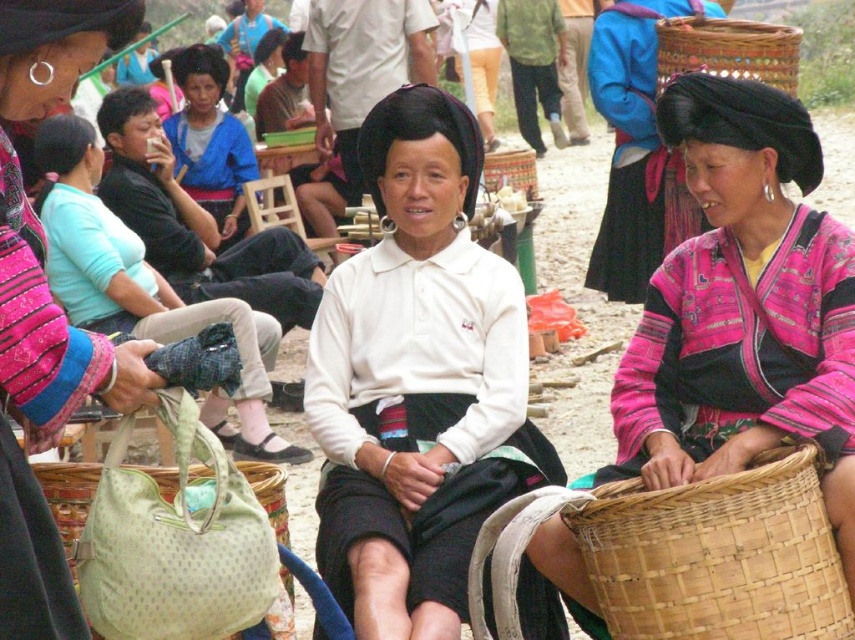
Is blue fabric shirt at center shorter than woven bamboo basket at upper right?

No, blue fabric shirt at center is not shorter than woven bamboo basket at upper right.

Based on the photo, is blue fabric shirt at center above woven bamboo basket at upper right?

Yes, blue fabric shirt at center is above woven bamboo basket at upper right.

You are a GUI agent. You are given a task and a screenshot of the screen. Output one action in this format:
    pyautogui.click(x=<x>, y=<y>)
    Task: Click on the blue fabric shirt at center
    
    Given the screenshot: What is the action you would take?
    pyautogui.click(x=210, y=140)

Does point (438, 470) come closer to viewer compared to point (664, 40)?

Yes.

Can you confirm if white matte shirt at center is positioned to the left of woven bamboo basket at upper right?

Yes, white matte shirt at center is to the left of woven bamboo basket at upper right.

Does point (425, 120) come in front of point (747, 77)?

Yes, point (425, 120) is closer to viewer.

This screenshot has width=855, height=640. In order to click on white matte shirt at center in this screenshot , I will do `click(417, 381)`.

Between point (753, 122) and point (199, 124), which one is positioned behind?

The point (199, 124) is behind.

Is point (743, 396) positioned after point (217, 138)?

No, it is in front of (217, 138).

Who is more forward, (768, 90) or (225, 129)?

Point (768, 90) is more forward.

Locate an element on the screen. Image resolution: width=855 pixels, height=640 pixels. pink woven fabric at center is located at coordinates (741, 307).